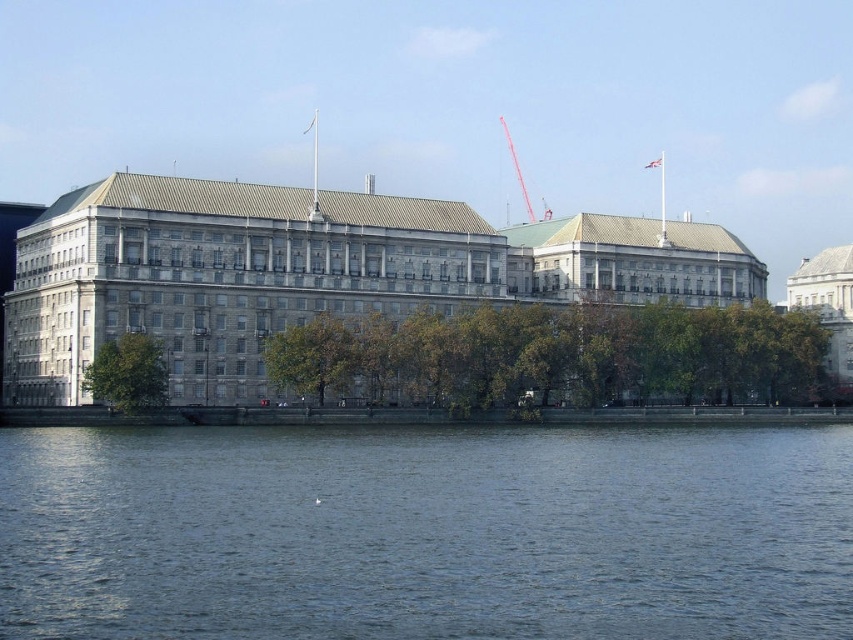
Question: Considering the relative positions of blue water at lower center and gray stone building at center in the image provided, where is blue water at lower center located with respect to gray stone building at center?

Choices:
 (A) left
 (B) right

Answer: (A)

Question: Is blue water at lower center to the left of gray stone building at center from the viewer's perspective?

Choices:
 (A) no
 (B) yes

Answer: (B)

Question: Is blue water at lower center to the right of gray stone building at center from the viewer's perspective?

Choices:
 (A) yes
 (B) no

Answer: (B)

Question: Which point is farther to the camera?

Choices:
 (A) (628, 250)
 (B) (833, 554)

Answer: (A)

Question: Among these points, which one is farthest from the camera?

Choices:
 (A) (822, 614)
 (B) (444, 228)

Answer: (B)